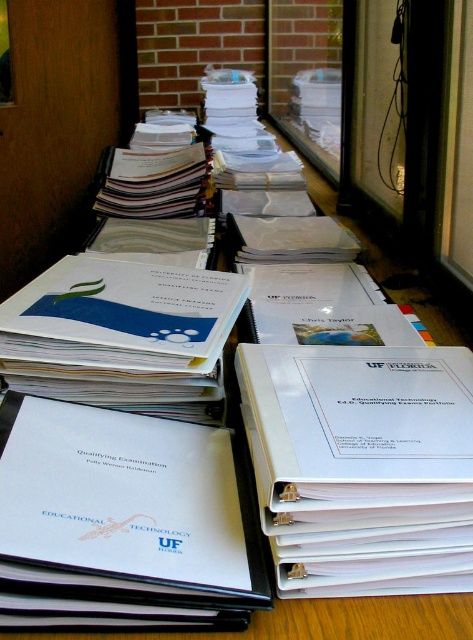
Question: Does white matte binder at center have a larger size compared to white plastic binder at center?

Choices:
 (A) no
 (B) yes

Answer: (A)

Question: Is white matte binder at center to the left of white plastic binder at center from the viewer's perspective?

Choices:
 (A) yes
 (B) no

Answer: (A)

Question: Which point appears farthest from the camera in this image?

Choices:
 (A) (64, 440)
 (B) (377, 516)

Answer: (A)

Question: Is white matte binder at center bigger than white plastic binder at center?

Choices:
 (A) yes
 (B) no

Answer: (B)